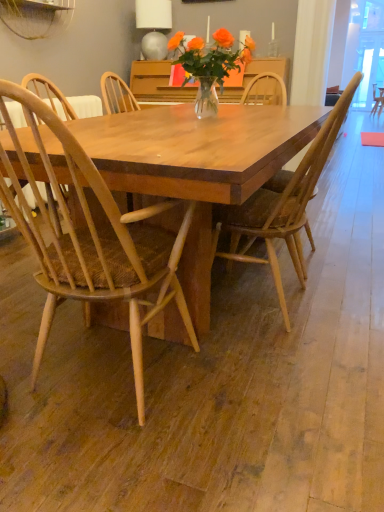
Question: From a real-world perspective, is wooden chair at center, the 2th chair in the left-to-right sequence, physically above matte gray lampshade at upper center?

Choices:
 (A) yes
 (B) no

Answer: (B)

Question: From the image's perspective, is wooden chair at center, the 2th chair in the left-to-right sequence, below matte gray lampshade at upper center?

Choices:
 (A) no
 (B) yes

Answer: (B)

Question: Is matte gray lampshade at upper center inside wooden chair at center, which is counted as the 1th chair, starting from the right?

Choices:
 (A) no
 (B) yes

Answer: (A)

Question: Does wooden chair at center, which is counted as the 1th chair, starting from the right, have a lesser width compared to matte gray lampshade at upper center?

Choices:
 (A) no
 (B) yes

Answer: (A)

Question: From a real-world perspective, is wooden chair at center, the 2th chair in the left-to-right sequence, beneath matte gray lampshade at upper center?

Choices:
 (A) no
 (B) yes

Answer: (B)

Question: From their relative heights in the image, would you say matte gray lampshade at upper center is taller or shorter than wooden chair at center, the 2th chair in the left-to-right sequence?

Choices:
 (A) tall
 (B) short

Answer: (B)

Question: Considering the positions of matte gray lampshade at upper center and wooden chair at center, which is counted as the 1th chair, starting from the right, in the image, is matte gray lampshade at upper center wider or thinner than wooden chair at center, which is counted as the 1th chair, starting from the right,?

Choices:
 (A) thin
 (B) wide

Answer: (A)

Question: In the image, is matte gray lampshade at upper center on the left side or the right side of wooden chair at center, the 2th chair in the left-to-right sequence?

Choices:
 (A) left
 (B) right

Answer: (A)

Question: From the image's perspective, relative to wooden chair at center, which is counted as the 1th chair, starting from the right, is matte gray lampshade at upper center above or below?

Choices:
 (A) below
 (B) above

Answer: (B)

Question: From a real-world perspective, is natural wood chair at center, which is the 1th chair in left-to-right order, positioned above or below wooden chair at center, which is counted as the 1th chair, starting from the right?

Choices:
 (A) below
 (B) above

Answer: (A)

Question: Relative to wooden chair at center, the 2th chair in the left-to-right sequence, is natural wood chair at center, which is the 1th chair in left-to-right order, in front or behind?

Choices:
 (A) front
 (B) behind

Answer: (A)

Question: Is natural wood chair at center, which is the 1th chair in left-to-right order, wider or thinner than wooden chair at center, the 2th chair in the left-to-right sequence?

Choices:
 (A) thin
 (B) wide

Answer: (A)

Question: Based on their sizes in the image, would you say natural wood chair at center, which is the 1th chair in left-to-right order, is bigger or smaller than wooden chair at center, the 2th chair in the left-to-right sequence?

Choices:
 (A) big
 (B) small

Answer: (A)

Question: From the image's perspective, is wooden chair at center, which is counted as the 1th chair, starting from the right, positioned above or below matte gray lampshade at upper center?

Choices:
 (A) above
 (B) below

Answer: (B)

Question: In the image, is wooden chair at center, the 2th chair in the left-to-right sequence, positioned in front of or behind matte gray lampshade at upper center?

Choices:
 (A) front
 (B) behind

Answer: (A)